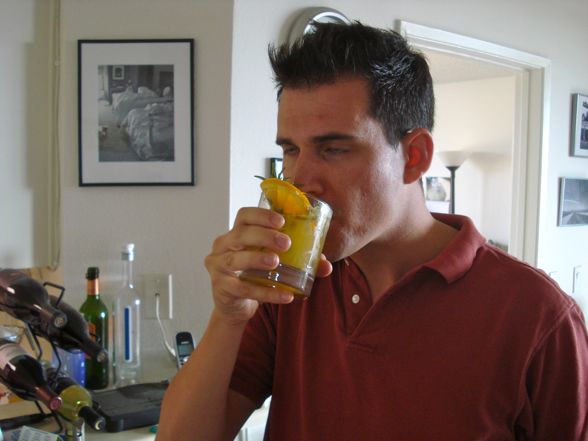
You are a GUI agent. You are given a task and a screenshot of the screen. Output one action in this format:
    pyautogui.click(x=<x>, y=<y>)
    Task: Click on the clock
    The height and width of the screenshot is (441, 588).
    Given the screenshot: What is the action you would take?
    pyautogui.click(x=319, y=25)